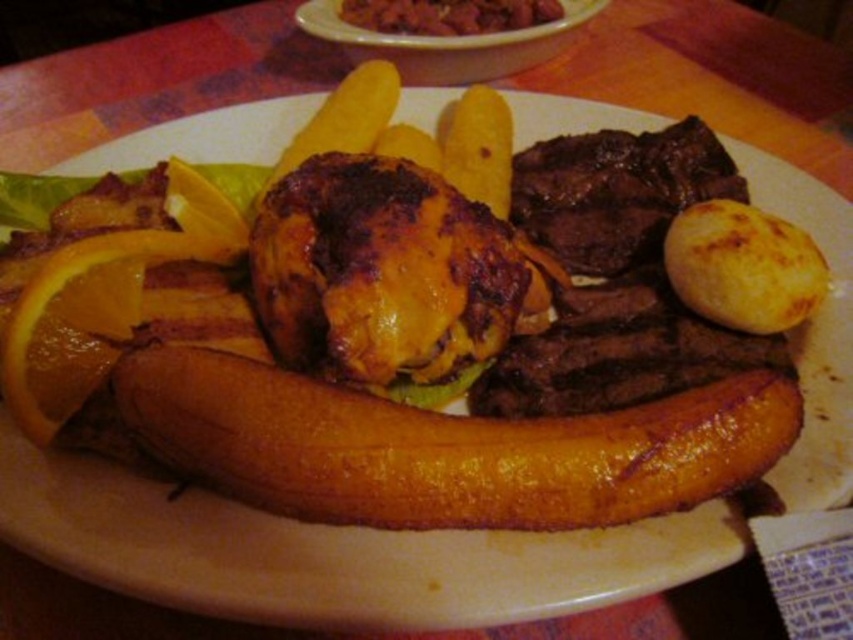
You are a food delivery person who needs to place a protective divider between the golden brown baked potato at right and the brown crispy meat at upper center to prevent them from touching during transport. The divider you have is 25 inches wide. Will it be sufficient to fit between them?

The golden brown baked potato at right and the brown crispy meat at upper center are 27.24 inches apart. The divider is only 25 inches wide, so it will not be sufficient to fit between them as it is shorter than the required distance.

You are a food critic trying to determine which item on the plate is wider. You see the golden brown baked potato at right and the brown crispy meat at upper center. Which one is wider?

The golden brown baked potato at right is less wide than the brown crispy meat at upper center, so the brown crispy meat at upper center is wider.

What is the 2D coordinate of the brown crispy beef at center?

The brown crispy beef at center is located at the 2D coordinate point of (381, 272).